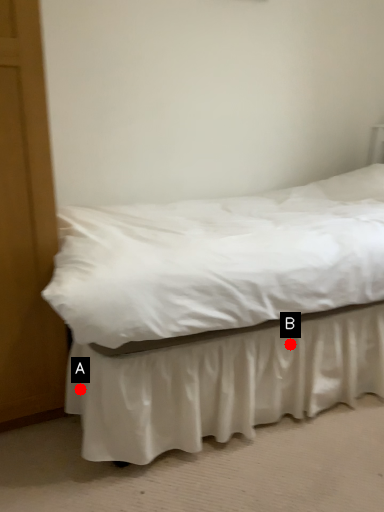
Question: Two points are circled on the image, labeled by A and B beside each circle. Which point is farther from the camera taking this photo?

Choices:
 (A) A is further
 (B) B is further

Answer: (B)